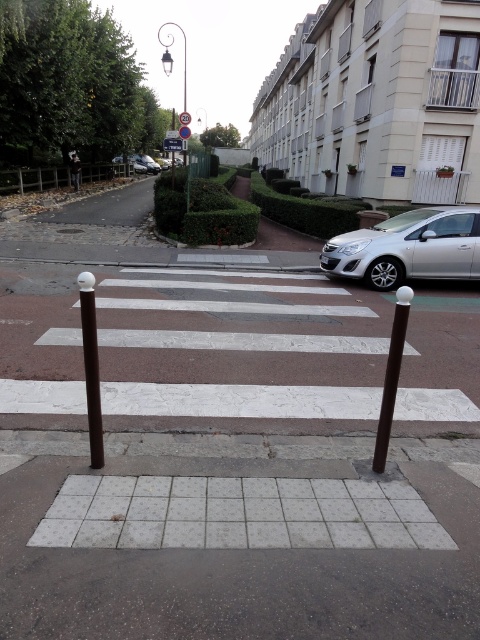
In the scene shown: You are a delivery person trying to park your 1.8 meters wide delivery cart between the brown matte pole at center and the brown polished pole at lower right. Can you fit your cart there?

The brown matte pole at center is shorter than the brown polished pole at lower right, but the distance between them isn not provided. Without knowing the space between the poles, it is impossible to determine if the cart will fit.

You are a delivery robot positioned at the starting point. You need to navigate to the destination point. The scene shows a quiet urban street with a pedestrian crossing and two bollards. There are two points marked as point 1 at coordinates (x=368, y=371) and point 2 at coordinates (x=355, y=266). Which point should you head towards first if you want to reach the destination point that is behind the second point?

Point 1 at coordinates (x=368, y=371) is in front of point 2 at coordinates (x=355, y=266), so you should head towards point 1 first to reach the destination point behind point 2.

You are a delivery driver who needs to park your vehicle between the two poles. Given that your car is 5 meters long, can you fit it between the brown matte pole at center and the brown polished pole at lower right?

The brown matte pole at center is in front of the brown polished pole at lower right, so there is insufficient space between them to accommodate a 5 meter long car.